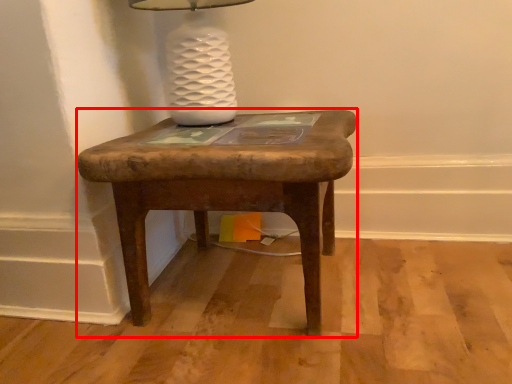
Question: Observing the image, what is the correct spatial positioning of stool (annotated by the red box) in reference to table lamp?

Choices:
 (A) left
 (B) right

Answer: (B)